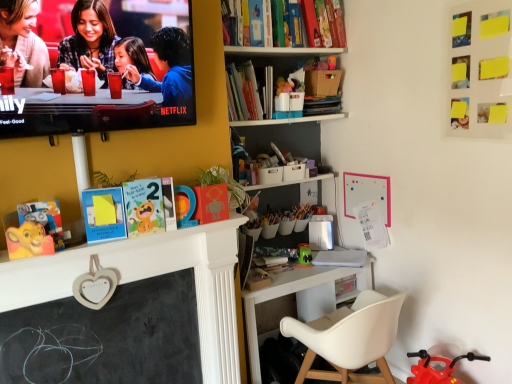
Where is `vacant region above white plastic desk at center (from a real-world perspective)`? vacant region above white plastic desk at center (from a real-world perspective) is located at coordinates (290, 267).